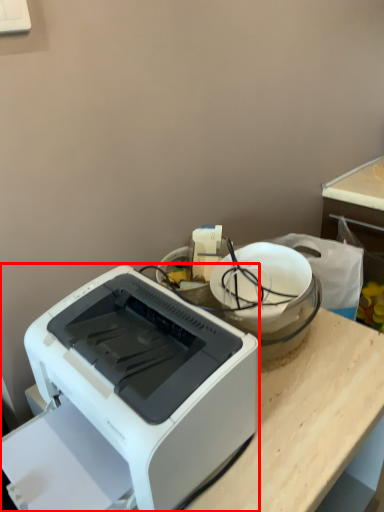
Question: Where is printer (annotated by the red box) located in relation to appliance in the image?

Choices:
 (A) left
 (B) right

Answer: (A)